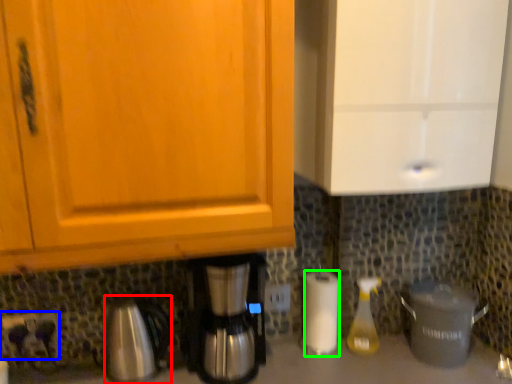
Question: Based on their relative distances, which object is nearer to coffeepot (highlighted by a red box)? Choose from power plugs and sockets (highlighted by a blue box) and paper towel (highlighted by a green box).

Choices:
 (A) power plugs and sockets
 (B) paper towel

Answer: (A)